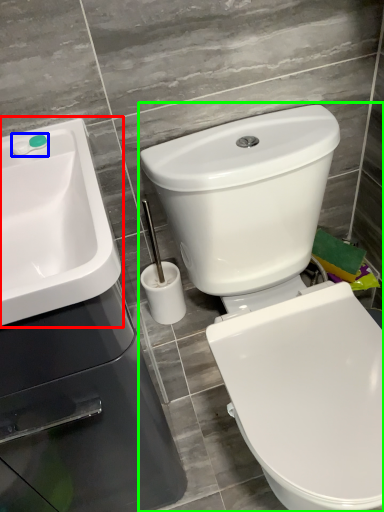
Question: Considering the real-world distances, which object is closest to sink (highlighted by a red box)? plumbing fixture (highlighted by a blue box) or toilet (highlighted by a green box).

Choices:
 (A) plumbing fixture
 (B) toilet

Answer: (A)